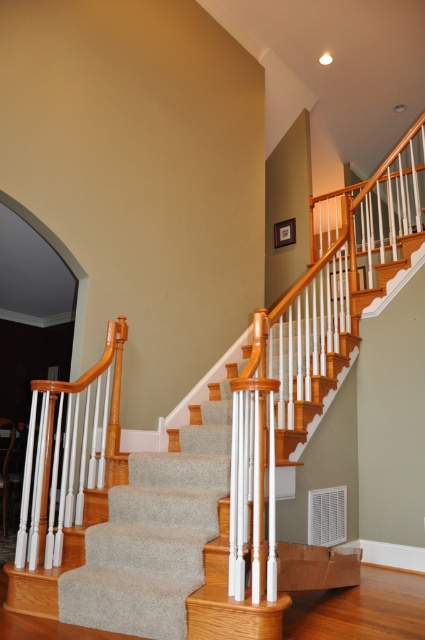
You are standing at the bottom of the carpeted stairs at center and want to reach the framed picture on the olive green wall. Which direction should you move relative to the wooden handrail at center to get closer to the framed picture?

Since the carpeted stairs at center is in front of the wooden handrail at center, you should move away from the wooden handrail at center to reach the framed picture on the olive green wall.

You are a person with a 16 inch wide backpack. You need to walk up the carpeted stairs at center while carrying your backpack. Can you safely hold onto the wooden handrail at center without the backpack hitting it?

The distance between the carpeted stairs at center and the wooden handrail at center is 15.96 inches. Since your backpack is 16 inches wide, there isn t enough space to hold the handrail without the backpack potentially hitting it.